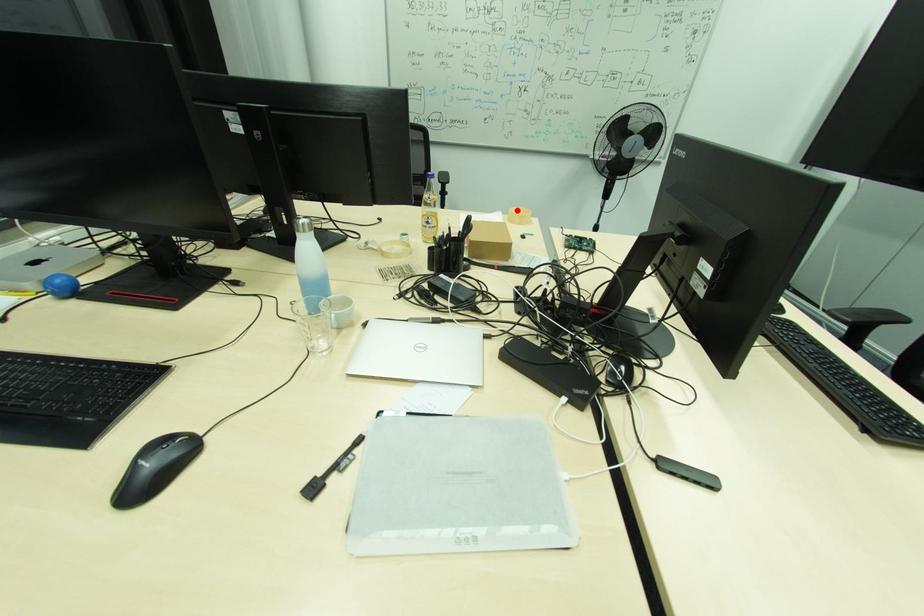
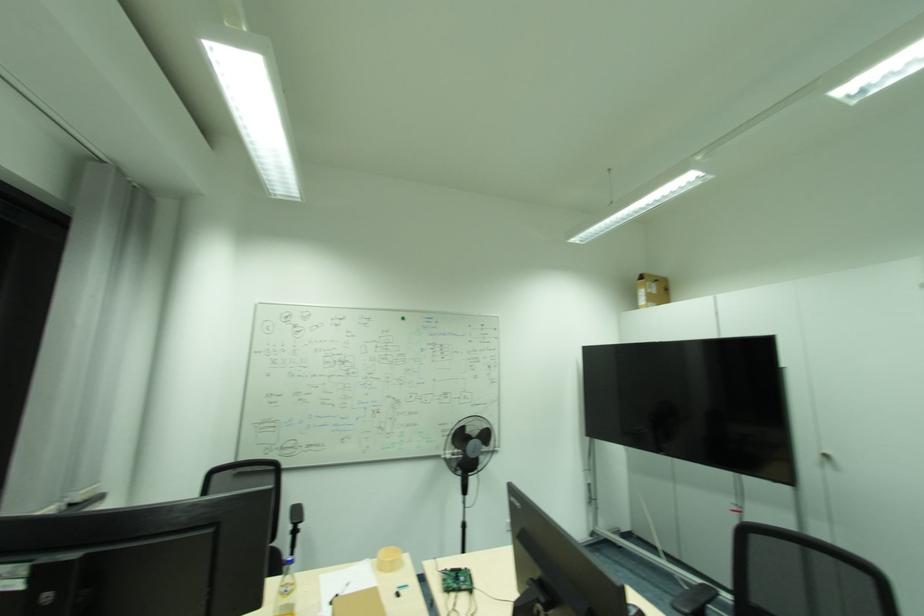
The point at the highlighted location is marked in the first image. Where is the corresponding point in the second image?

(386, 553)